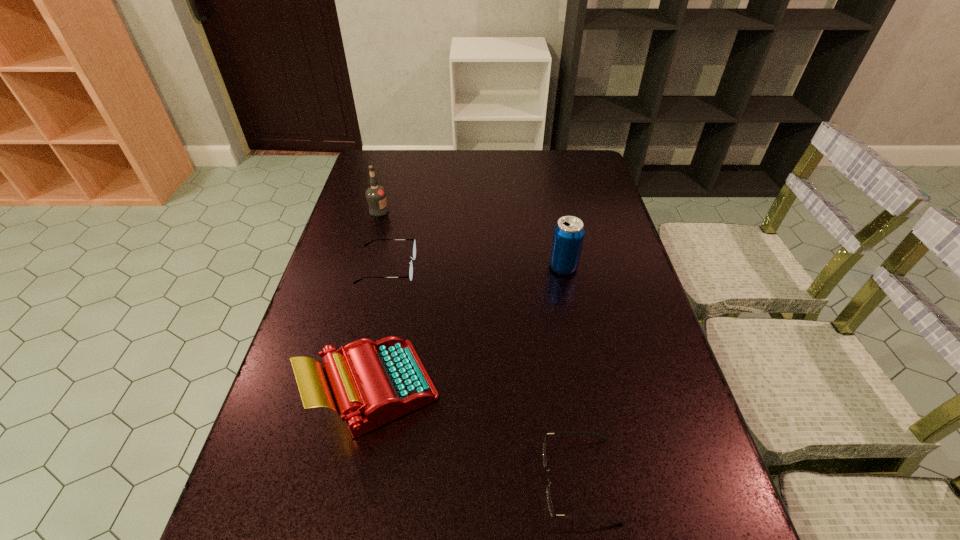
I want to click on the farthest object, so click(376, 195).

At what (x,y) coordinates should I click in order to perform the action: click on pop soda. Please return your answer as a coordinate pair (x, y). This screenshot has height=540, width=960. Looking at the image, I should click on (568, 235).

Where is `typewriter`? typewriter is located at coordinates (368, 383).

Where is `the taller spectacles`? This screenshot has width=960, height=540. the taller spectacles is located at coordinates (413, 257).

The height and width of the screenshot is (540, 960). What are the coordinates of `the farther spectacles` in the screenshot? It's located at (413, 257).

Where is `the shorter spectacles`? Image resolution: width=960 pixels, height=540 pixels. the shorter spectacles is located at coordinates (603, 438).

Where is `the shortest object`? The height and width of the screenshot is (540, 960). the shortest object is located at coordinates (603, 438).

I want to click on free location located 0.160m on the front label of the farthest object, so click(x=438, y=211).

This screenshot has height=540, width=960. In order to click on vacant region located on the front of the pop soda in this screenshot , I will do `click(589, 397)`.

Where is `free spot located on the typing side of the typewriter`? The image size is (960, 540). free spot located on the typing side of the typewriter is located at coordinates (620, 389).